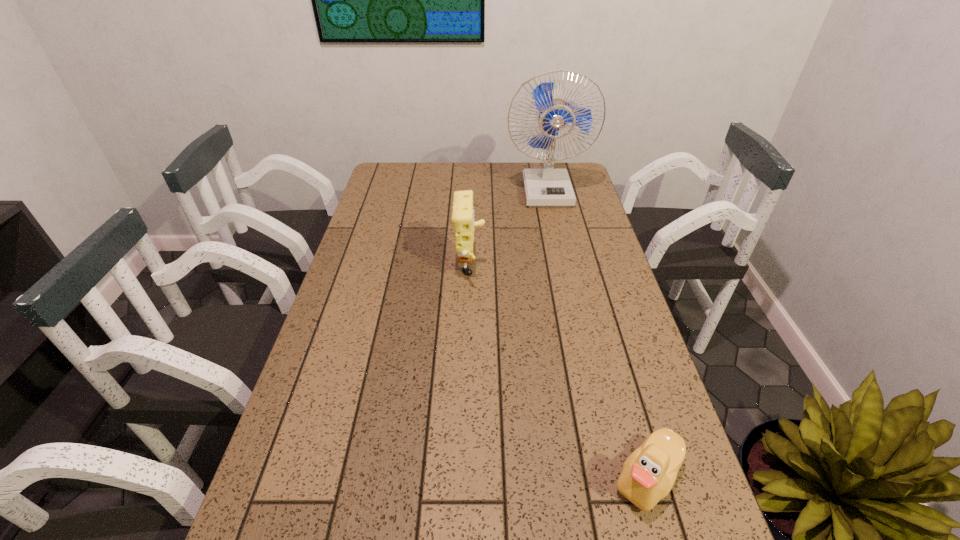
Locate which object ranks in proximity to the second nearest object. Please provide its 2D coordinates. Your answer should be formatted as a tuple, i.e. [(x, y)], where the tuple contains the x and y coordinates of a point satisfying the conditions above.

[(547, 187)]

The image size is (960, 540). In order to click on object that is the closest one to the duck in this screenshot , I will do `click(463, 215)`.